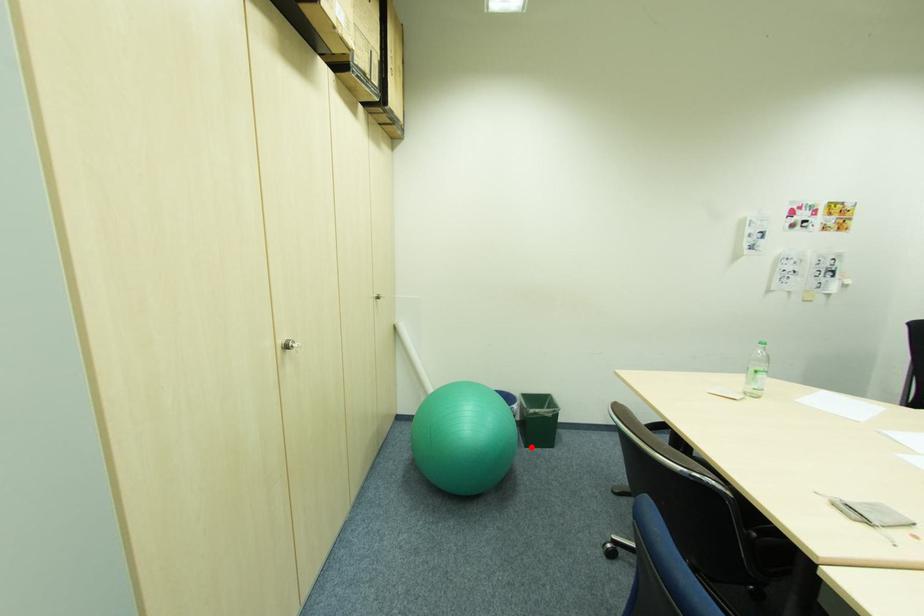
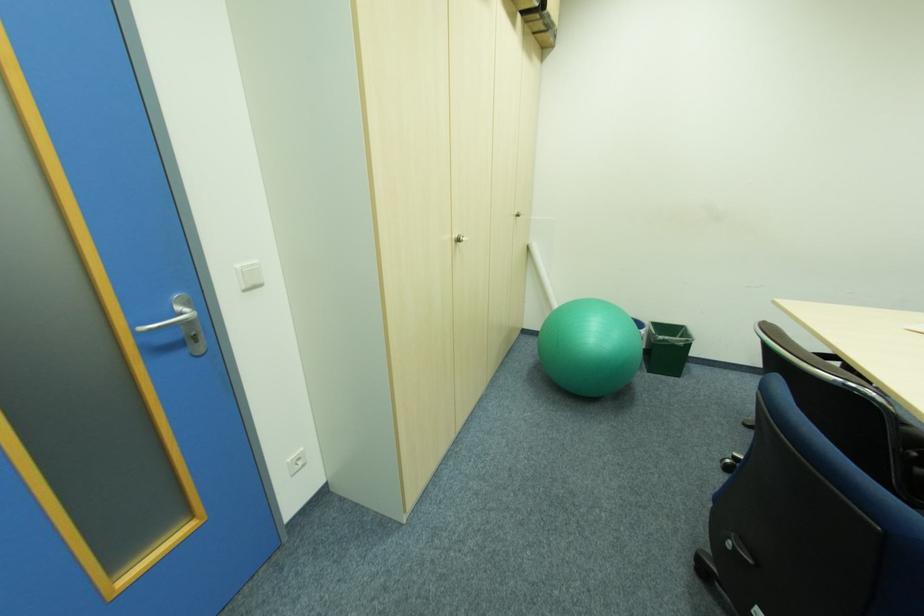
Question: I am providing you with two images of the same scene from different viewpoints. A red point is shown in image1. For the corresponding object point in image2, is it positioned nearer or farther from the camera?

Choices:
 (A) Nearer
 (B) Farther

Answer: (B)